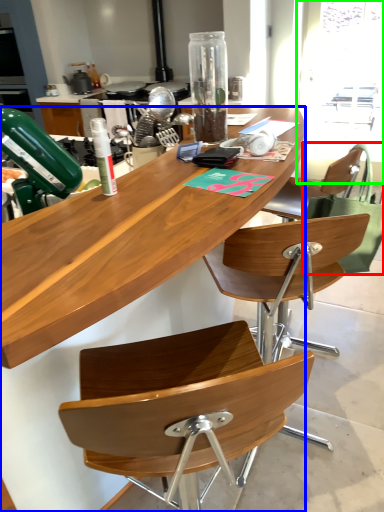
Question: Estimate the real-world distances between objects in this image. Which object is farther from handbag (highlighted by a red box), desk (highlighted by a blue box) or window screen (highlighted by a green box)?

Choices:
 (A) desk
 (B) window screen

Answer: (B)